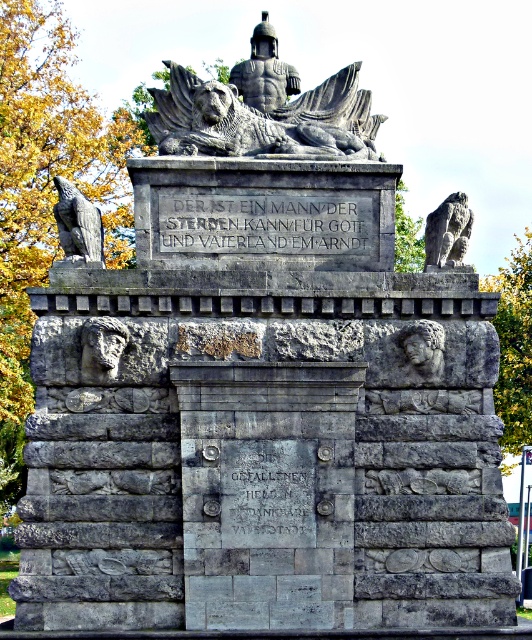
Does dark gray stone lion at upper center come behind gray stone eagle at upper left?

Yes, it is behind gray stone eagle at upper left.

Between point (153, 129) and point (101, 260), which one is positioned behind?

The point (153, 129) is behind.

Who is more forward, (198, 134) or (97, 243)?

Point (97, 243) is more forward.

The image size is (532, 640). Find the location of `dark gray stone lion at upper center`. dark gray stone lion at upper center is located at coordinates (262, 118).

Between stone inscription at center and gray stone eagle at upper left, which one appears on the left side from the viewer's perspective?

gray stone eagle at upper left is more to the left.

From the picture: Can you confirm if stone inscription at center is shorter than gray stone eagle at upper left?

Yes, stone inscription at center is shorter than gray stone eagle at upper left.

This screenshot has height=640, width=532. I want to click on stone inscription at center, so click(x=268, y=506).

You are a GUI agent. You are given a task and a screenshot of the screen. Output one action in this format:
    pyautogui.click(x=<x>, y=<y>)
    Task: Click on the stone inscription at center
    This screenshot has height=640, width=532.
    Given the screenshot: What is the action you would take?
    pyautogui.click(x=268, y=506)

Who is more forward, (354,225) or (451,216)?

Point (451,216) is in front.

Measure the distance between gray stone inscription at center and gray stone eagle at upper right.

gray stone inscription at center and gray stone eagle at upper right are 18.10 meters apart.

I want to click on gray stone inscription at center, so click(266, 225).